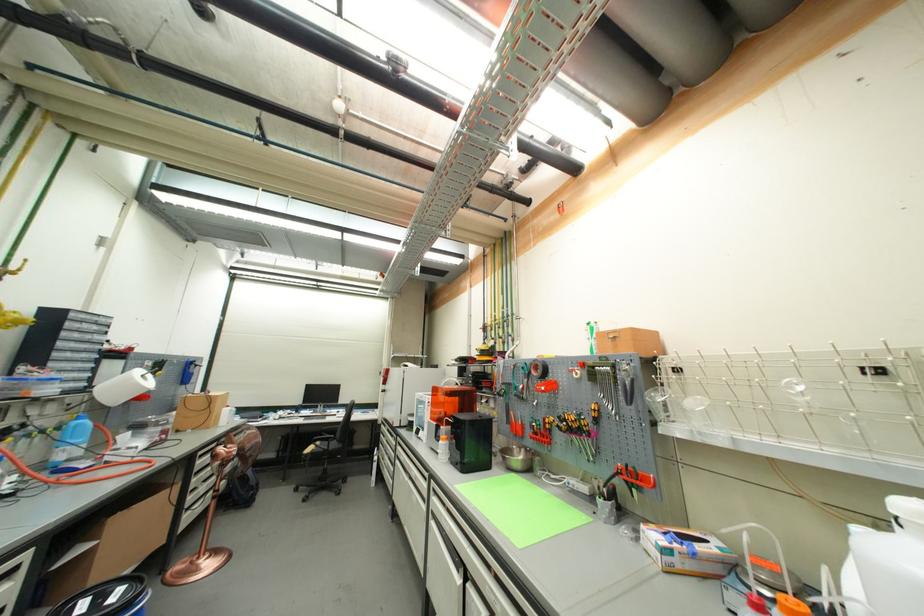
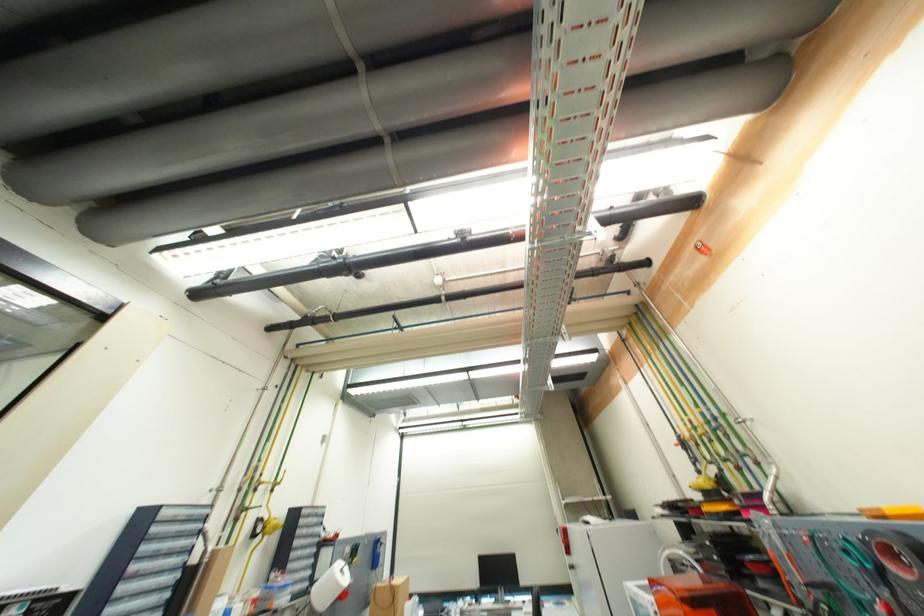
The first image is from the beginning of the video and the second image is from the end. How did the camera likely rotate when shooting the video?

The camera's rotation is toward left-up.